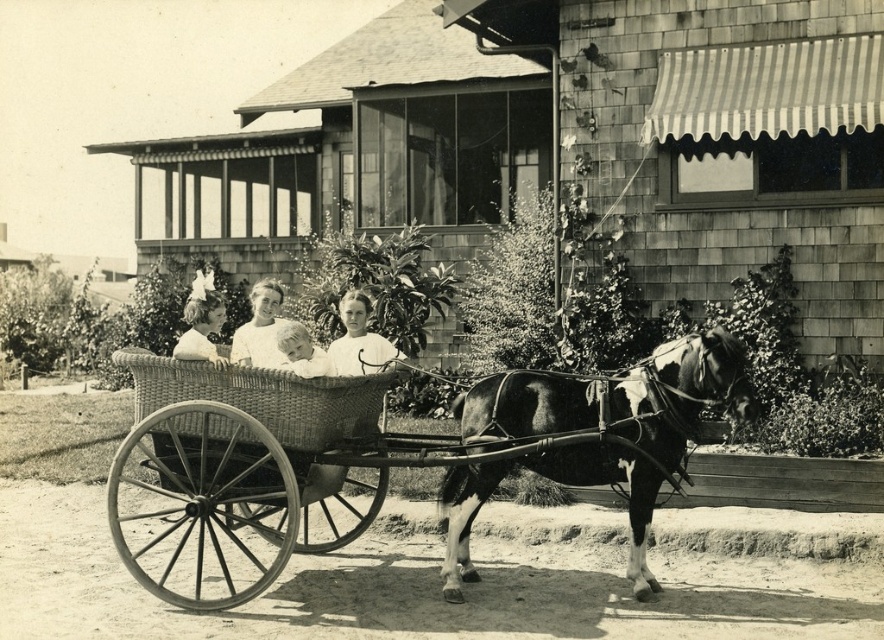
Question: Considering the relative positions of black and white horse at center and smooth white shirt at center in the image provided, where is black and white horse at center located with respect to smooth white shirt at center?

Choices:
 (A) right
 (B) left

Answer: (A)

Question: Which of the following is the closest to the observer?

Choices:
 (A) (522, 392)
 (B) (291, 340)

Answer: (B)

Question: Does black and white horse at center come in front of smooth white shirt at center?

Choices:
 (A) yes
 (B) no

Answer: (A)

Question: Which object is the closest to the white cotton dress at center?

Choices:
 (A) smooth white shirt at center
 (B) woven wood cart at center

Answer: (A)

Question: Which point appears closest to the camera in this image?

Choices:
 (A) (671, 352)
 (B) (309, 349)
 (C) (189, 371)
 (D) (360, 378)

Answer: (A)

Question: Is woven wood cart at center to the left of white cotton dress at center from the viewer's perspective?

Choices:
 (A) no
 (B) yes

Answer: (A)